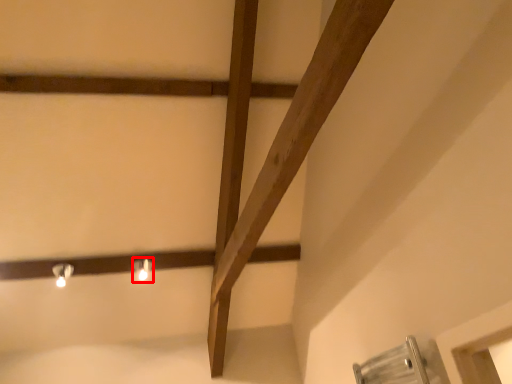
Question: From the image's perspective, considering the relative positions of light fixture (annotated by the red box) and light fixture in the image provided, where is light fixture (annotated by the red box) located with respect to the staircase?

Choices:
 (A) above
 (B) below

Answer: (A)